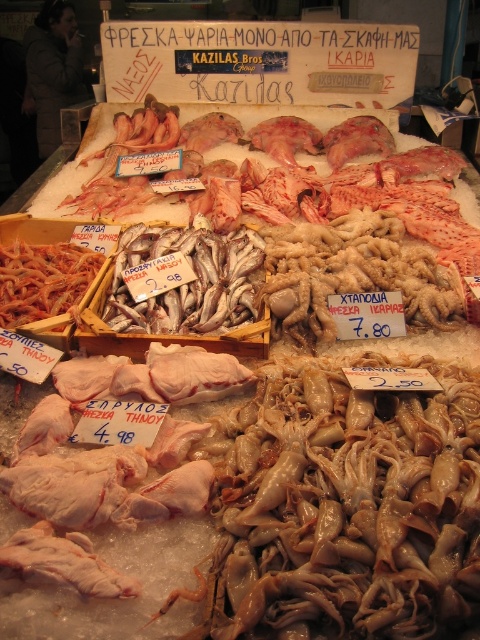
You are a customer at the seafood market stall. You want to buy the taller item between the white fish at center and the white raw squid at center. Which one should you choose?

The white fish at center is much taller than the white raw squid at center, so you should choose the white fish at center.